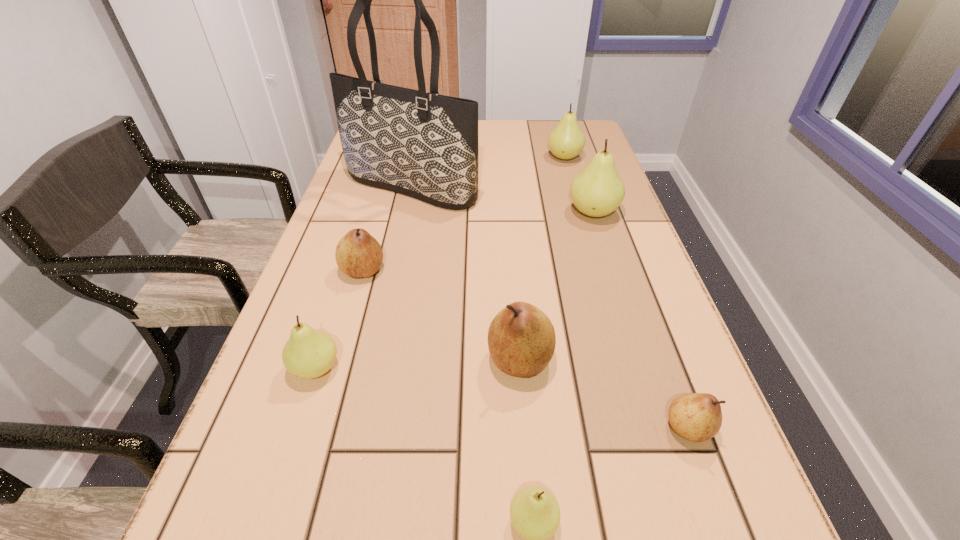
You are a GUI agent. You are given a task and a screenshot of the screen. Output one action in this format:
    pyautogui.click(x=<x>, y=<y>)
    Task: Click on the vacant space that is in between the seventh farthest object and the farthest object
    
    Given the screenshot: What is the action you would take?
    pyautogui.click(x=626, y=293)

This screenshot has width=960, height=540. I want to click on free spot between the seventh farthest object and the farthest green pear, so click(626, 293).

The width and height of the screenshot is (960, 540). In order to click on empty space that is in between the second brown pear from right to left and the fifth nearest object in this screenshot , I will do `click(442, 315)`.

Find the location of a particular element. This screenshot has height=540, width=960. empty space between the second nearest object and the second tallest object is located at coordinates (640, 320).

In order to click on free space between the second biggest green pear and the third biggest green pear in this screenshot , I will do `click(441, 262)`.

Locate an element on the screen. unoccupied area between the second farthest brown pear and the second nearest object is located at coordinates (604, 393).

Locate an element on the screen. Image resolution: width=960 pixels, height=540 pixels. object that is the fourth closest to the smallest green pear is located at coordinates (358, 254).

Select which object appears as the seventh closest to the third nearest green pear. Please provide its 2D coordinates. Your answer should be formatted as a tuple, i.e. [(x, y)], where the tuple contains the x and y coordinates of a point satisfying the conditions above.

[(534, 511)]

In order to click on pear that is the fifth closest one to the third biggest green pear in this screenshot , I will do `click(597, 191)`.

Locate an element on the screen. pear that is the fifth closest to the leftmost green pear is located at coordinates (597, 191).